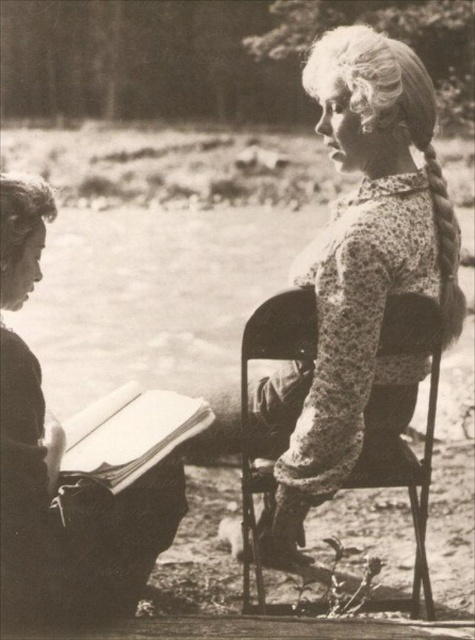
From the picture: Does smooth paper book at left have a greater width compared to metallic black chair at center?

Incorrect, smooth paper book at left's width does not surpass metallic black chair at center's.

Between point (35, 394) and point (282, 317), which one is positioned behind?

The point (282, 317) is more distant.

Is point (167, 481) farther from viewer compared to point (303, 317)?

Yes, it is behind point (303, 317).

Locate an element on the screen. smooth paper book at left is located at coordinates (70, 518).

Between floral-patterned fabric at center-right and thick paper book at lower left, which one is positioned lower?

thick paper book at lower left is lower down.

Can you confirm if floral-patterned fabric at center-right is thinner than thick paper book at lower left?

No, floral-patterned fabric at center-right is not thinner than thick paper book at lower left.

Find the location of `floral-patterned fabric at center-right`. floral-patterned fabric at center-right is located at coordinates (363, 273).

Is floral-patterned fabric at center-right thinner than metallic black chair at center?

Incorrect, floral-patterned fabric at center-right's width is not less than metallic black chair at center's.

Is floral-patterned fabric at center-right positioned behind metallic black chair at center?

No, it is in front of metallic black chair at center.

You are a GUI agent. You are given a task and a screenshot of the screen. Output one action in this format:
    pyautogui.click(x=<x>, y=<y>)
    Task: Click on the floral-patterned fabric at center-right
    The height and width of the screenshot is (640, 475).
    Given the screenshot: What is the action you would take?
    pyautogui.click(x=363, y=273)